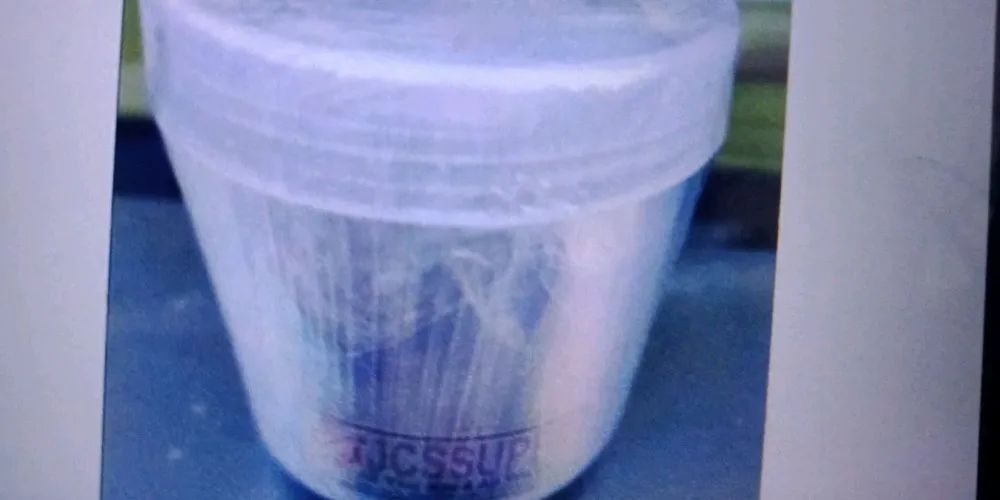
At what (x,y) coordinates should I click in order to perform the action: click on table. Please return your answer as a coordinate pair (x, y). This screenshot has width=1000, height=500. Looking at the image, I should click on (701, 391).